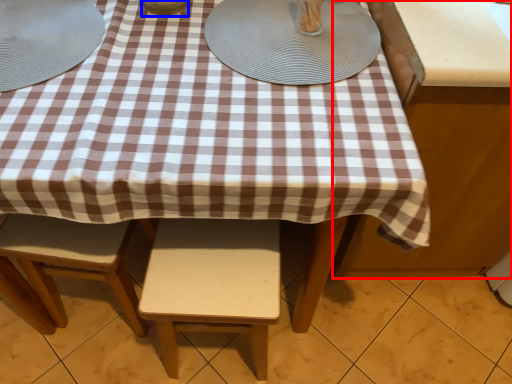
Question: Which point is closer to the camera, table (highlighted by a red box) or tableware (highlighted by a blue box)?

Choices:
 (A) table
 (B) tableware

Answer: (B)